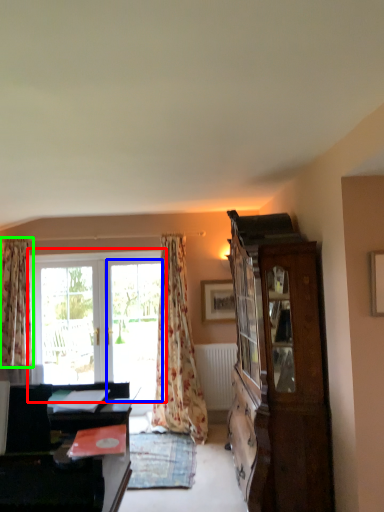
Question: Which object is the farthest from window (highlighted by a red box)? Choose among these: screen door (highlighted by a blue box) or curtain (highlighted by a green box).

Choices:
 (A) screen door
 (B) curtain

Answer: (B)